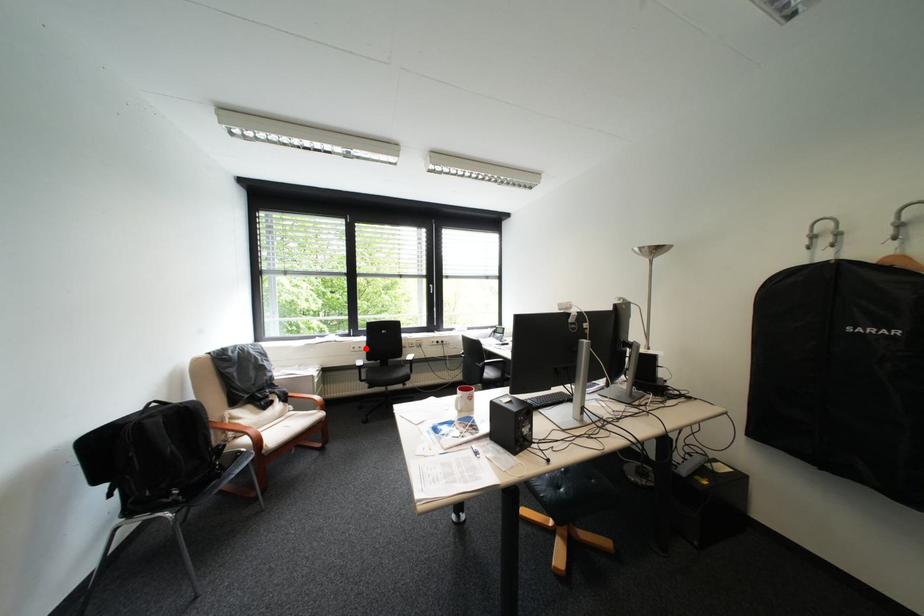
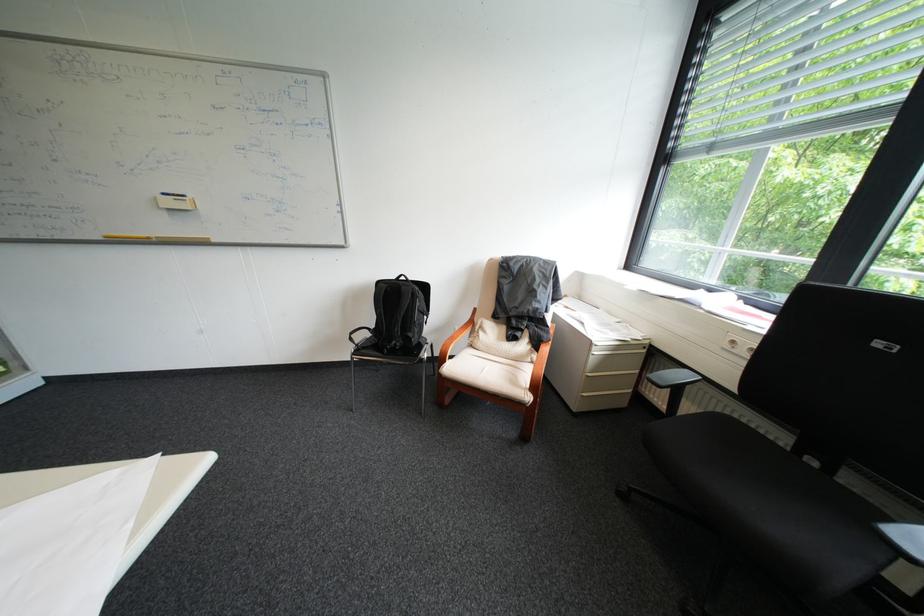
Find the pixel in the second image that matches the highlighted location in the first image.

(746, 342)